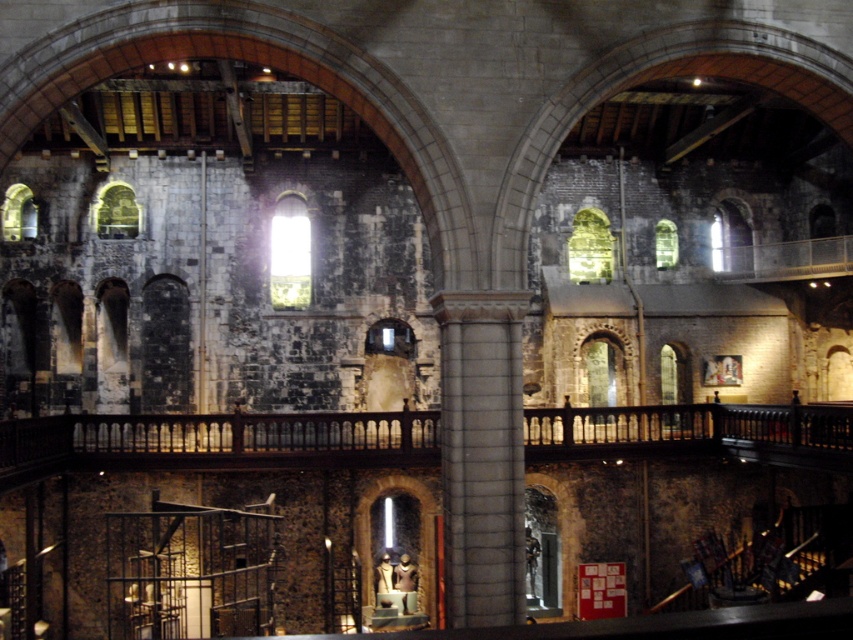
In the scene shown: You are an architect designing a new support beam that needs to span the distance between the dark wood balustrade at center and the gray stone column at center. What is the minimum length your beam must be to cover this distance?

The dark wood balustrade at center and gray stone column at center are 17.07 meters apart from each other. Therefore, the minimum length of the support beam must be at least 17.07 meters to span the distance between them.

You are an architect designing a restoration project for this historic building. You need to ensure that the dark wood balustrade at center and the gray stone column at center are proportionally balanced. Given their sizes, which object should you consider adjusting to achieve a harmonious design?

The dark wood balustrade at center has a larger size compared to the gray stone column at center. To achieve a harmonious design, you should consider reducing the size of the dark wood balustrade at center or increasing the size of the gray stone column at center.

You are an architect inspecting the building and need to compare the height of the dark wood balustrade at center and the gray stone column at center. Which one is taller?

The gray stone column at center is taller than the dark wood balustrade at center.